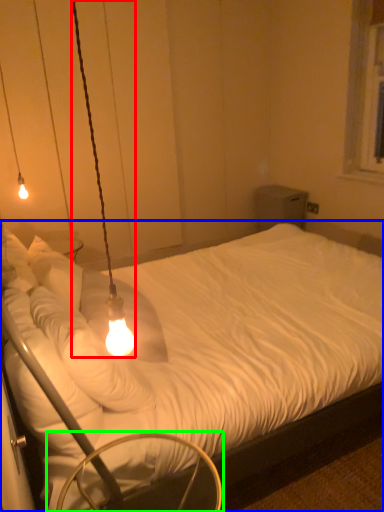
Question: Considering the real-world distances, which object is closest to lamp (highlighted by a red box)? bed (highlighted by a blue box) or swivel chair (highlighted by a green box).

Choices:
 (A) bed
 (B) swivel chair

Answer: (B)